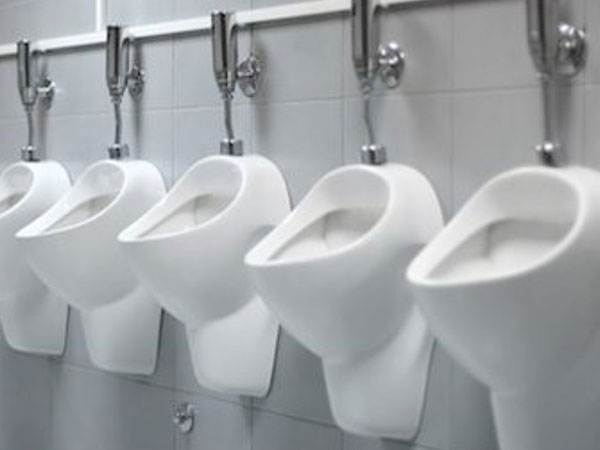
Locate an element on the screen. This screenshot has width=600, height=450. porcelain urinals is located at coordinates (40, 186), (114, 186), (210, 190), (351, 204), (518, 205).